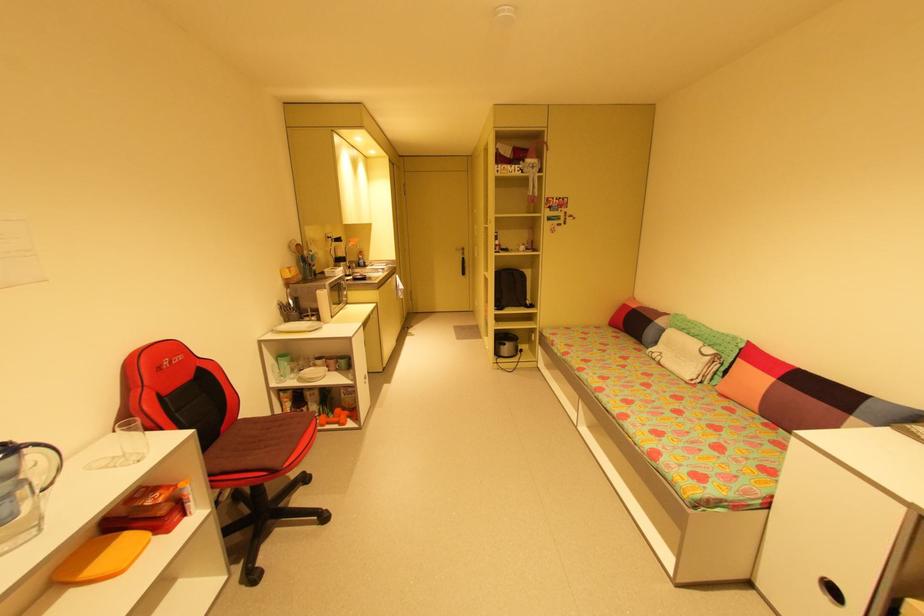
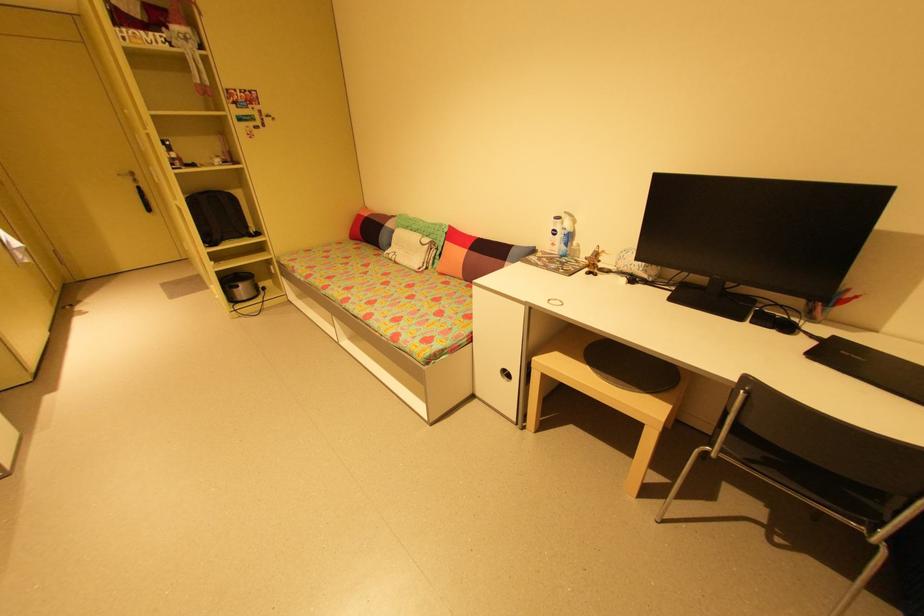
Question: I am providing you with two images of the same scene from different viewpoints. Please identify which objects are invisible in image2.

Choices:
 (A) checkered pillow
 (B) black chair sitting surface
 (C) small silver appliance
 (D) none of these

Answer: (D)